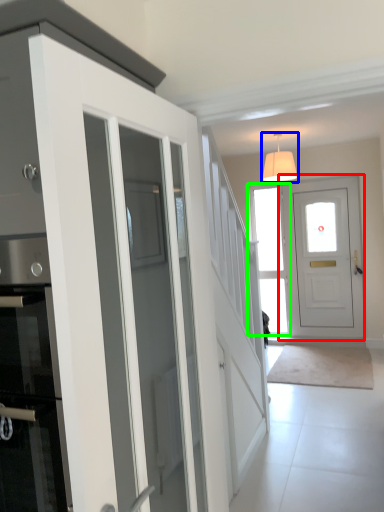
Question: Based on their relative distances, which object is nearer to door (highlighted by a red box)? Choose from lamp (highlighted by a blue box) and window (highlighted by a green box).

Choices:
 (A) lamp
 (B) window

Answer: (B)